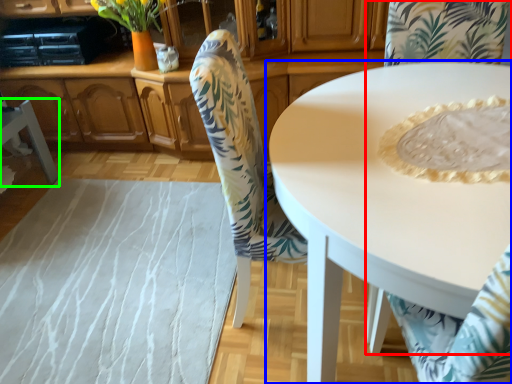
Question: Which object is the closest to the chair (highlighted by a red box)? Choose among these: coffee table (highlighted by a blue box) or chair (highlighted by a green box).

Choices:
 (A) coffee table
 (B) chair

Answer: (A)